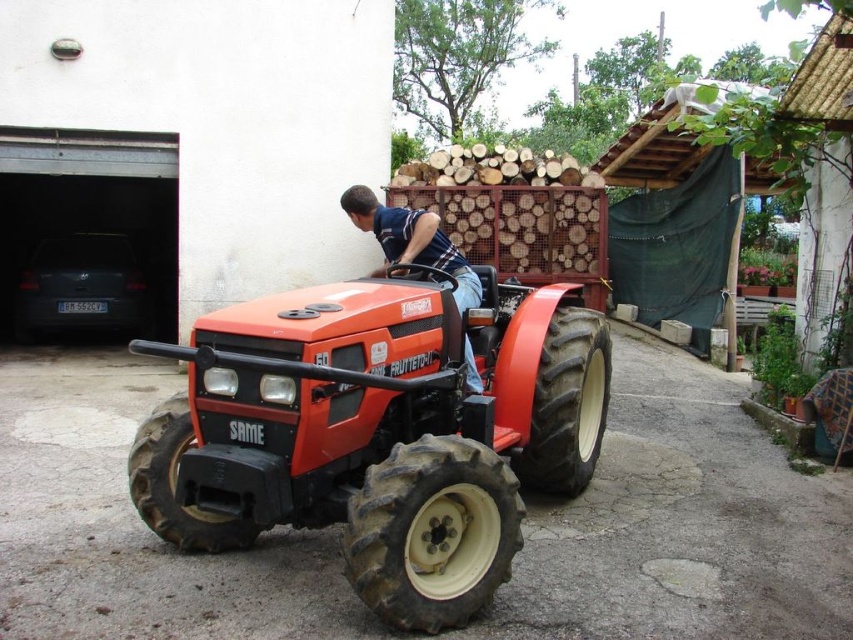
Question: Does matte orange tractor at center have a greater width compared to blue striped shirt at center?

Choices:
 (A) yes
 (B) no

Answer: (A)

Question: Is matte orange tractor at center to the left of blue striped shirt at center from the viewer's perspective?

Choices:
 (A) no
 (B) yes

Answer: (A)

Question: Among these objects, which one is nearest to the camera?

Choices:
 (A) blue striped shirt at center
 (B) matte orange tractor at center

Answer: (B)

Question: Can you confirm if matte orange tractor at center is positioned to the left of blue striped shirt at center?

Choices:
 (A) no
 (B) yes

Answer: (A)